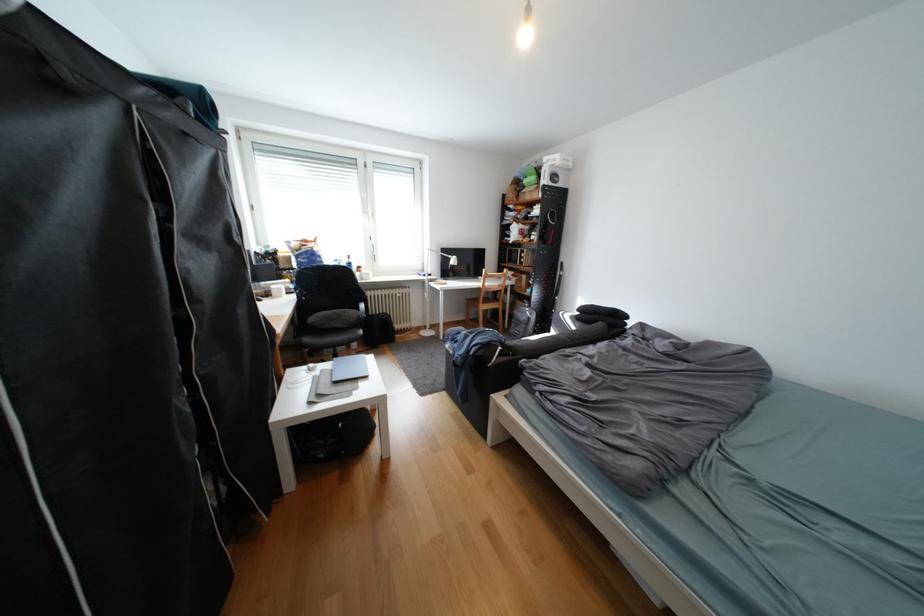
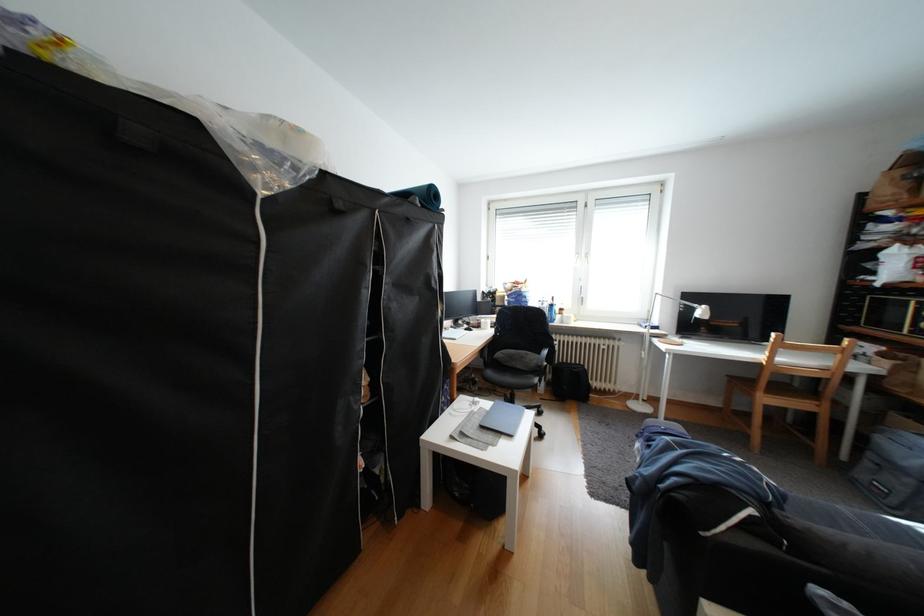
The point at (479, 337) is marked in the first image. Where is the corresponding point in the second image?

(682, 448)